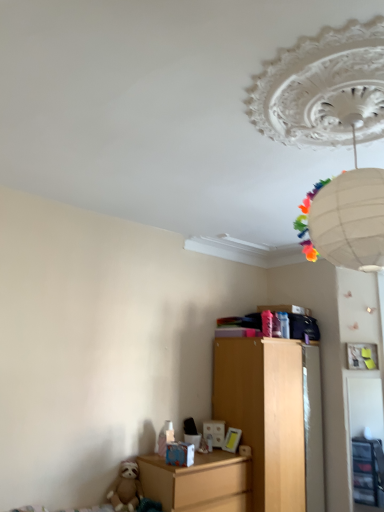
Question: Considering the relative sizes of white paper lantern at upper center and brown plush sloth at lower left in the image provided, is white paper lantern at upper center taller than brown plush sloth at lower left?

Choices:
 (A) no
 (B) yes

Answer: (B)

Question: Can you see white paper lantern at upper center touching brown plush sloth at lower left?

Choices:
 (A) no
 (B) yes

Answer: (A)

Question: Does white paper lantern at upper center appear on the right side of brown plush sloth at lower left?

Choices:
 (A) no
 (B) yes

Answer: (B)

Question: Can you confirm if white paper lantern at upper center is smaller than brown plush sloth at lower left?

Choices:
 (A) yes
 (B) no

Answer: (B)

Question: Does white paper lantern at upper center have a lesser width compared to brown plush sloth at lower left?

Choices:
 (A) yes
 (B) no

Answer: (B)

Question: Can you confirm if white paper lantern at upper center is wider than brown plush sloth at lower left?

Choices:
 (A) no
 (B) yes

Answer: (B)

Question: Is brown plush sloth at lower left oriented towards white paper lantern at upper center?

Choices:
 (A) no
 (B) yes

Answer: (A)

Question: Could white paper lantern at upper center be considered to be inside brown plush sloth at lower left?

Choices:
 (A) no
 (B) yes

Answer: (A)

Question: Does brown plush sloth at lower left have a greater height compared to white paper lantern at upper center?

Choices:
 (A) yes
 (B) no

Answer: (B)

Question: Is brown plush sloth at lower left wider than white paper lantern at upper center?

Choices:
 (A) yes
 (B) no

Answer: (B)

Question: Is brown plush sloth at lower left not close to white paper lantern at upper center?

Choices:
 (A) no
 (B) yes

Answer: (B)

Question: From the image's perspective, is brown plush sloth at lower left over white paper lantern at upper center?

Choices:
 (A) no
 (B) yes

Answer: (A)

Question: Is brown plush sloth at lower left turned away from matte wooden nightstand at lower left?

Choices:
 (A) yes
 (B) no

Answer: (B)